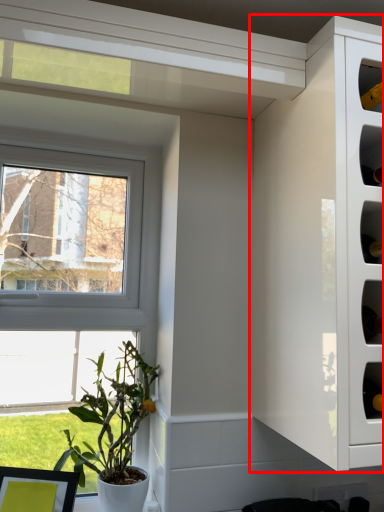
Question: Considering the relative positions of cabinetry (annotated by the red box) and houseplant in the image provided, where is cabinetry (annotated by the red box) located with respect to the staircase?

Choices:
 (A) left
 (B) right

Answer: (B)